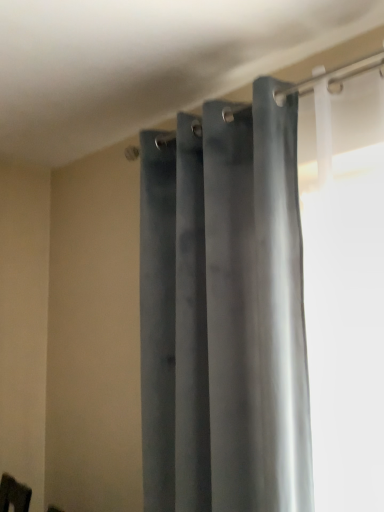
Describe the element at coordinates (232, 304) in the screenshot. The image size is (384, 512). I see `satin gray curtain at upper center` at that location.

What is the approximate width of satin gray curtain at upper center?

7.71 inches.

Image resolution: width=384 pixels, height=512 pixels. What are the coordinates of `satin gray curtain at upper center` in the screenshot? It's located at (232, 304).

The height and width of the screenshot is (512, 384). In order to click on satin gray curtain at upper center in this screenshot , I will do `click(232, 304)`.